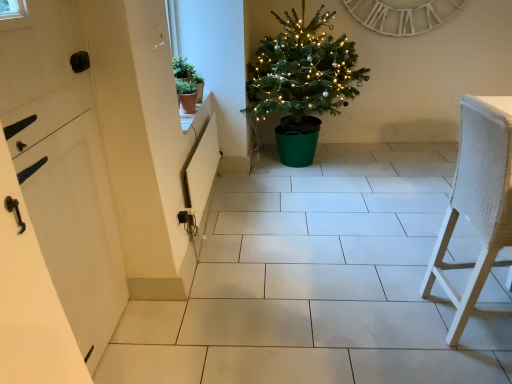
Image resolution: width=512 pixels, height=384 pixels. What do you see at coordinates (188, 116) in the screenshot?
I see `matte brown table at upper center` at bounding box center [188, 116].

Describe the element at coordinates (187, 94) in the screenshot. This screenshot has width=512, height=384. I see `green matte pot at upper left, arranged as the first houseplant when ordered from the bottom` at that location.

Where is `green matte pot at upper left, placed as the second houseplant when sorted from top to bottom`? This screenshot has height=384, width=512. green matte pot at upper left, placed as the second houseplant when sorted from top to bottom is located at coordinates (187, 94).

The image size is (512, 384). Describe the element at coordinates (63, 167) in the screenshot. I see `white painted wood door at left` at that location.

Measure the distance between green plastic christmas tree at center and camera.

green plastic christmas tree at center and camera are 3.07 meters apart.

What do you see at coordinates (477, 201) in the screenshot? This screenshot has height=384, width=512. I see `white woven chair at right` at bounding box center [477, 201].

Measure the distance between point (418, 32) and camera.

The depth of point (418, 32) is 3.66 meters.

This screenshot has height=384, width=512. I want to click on green matte plant pot at upper left, which is the second houseplant in bottom-to-top order, so click(187, 78).

From the image's perspective, between white woven chair at right and white painted wood door at left, who is located below?

white woven chair at right, from the image's perspective.

At what (x,y) coordinates should I click in order to perform the action: click on door on the left of white woven chair at right. Please return your answer as a coordinate pair (x, y). This screenshot has height=384, width=512. Looking at the image, I should click on (63, 167).

Is white woven chair at right shorter than white painted wood door at left?

Yes.

Considering the relative sizes of white woven chair at right and white painted wood door at left in the image provided, is white woven chair at right smaller than white painted wood door at left?

Actually, white woven chair at right might be larger than white painted wood door at left.

Image resolution: width=512 pixels, height=384 pixels. Identify the location of table behind the white woven chair at right. (188, 116).

Is matte brown table at upper center bigger or smaller than white woven chair at right?

matte brown table at upper center is smaller than white woven chair at right.

How different are the orientations of matte brown table at upper center and white woven chair at right in degrees?

2.41 degrees.

Which object is positioned more to the left, matte brown table at upper center or white woven chair at right?

Positioned to the left is matte brown table at upper center.

Locate an element on the screen. The height and width of the screenshot is (384, 512). the 1st houseplant above the white painted wood door at left (from the image's perspective) is located at coordinates (187, 94).

In terms of width, does green matte pot at upper left, arranged as the first houseplant when ordered from the bottom, look wider or thinner when compared to white painted wood door at left?

Clearly, green matte pot at upper left, arranged as the first houseplant when ordered from the bottom, has more width compared to white painted wood door at left.

Which of these two, green matte pot at upper left, placed as the second houseplant when sorted from top to bottom, or white painted wood door at left, stands taller?

With more height is white painted wood door at left.

Is green matte pot at upper left, arranged as the first houseplant when ordered from the bottom, closer to camera compared to white painted wood door at left?

That is False.

Considering the relative sizes of white wooden clock at upper center and matte brown table at upper center in the image provided, is white wooden clock at upper center shorter than matte brown table at upper center?

No.

From a real-world perspective, between white wooden clock at upper center and matte brown table at upper center, who is vertically lower?

→ In real-world perspective, matte brown table at upper center is lower.

From the image's perspective, would you say white wooden clock at upper center is shown under matte brown table at upper center?

Actually, white wooden clock at upper center appears above matte brown table at upper center in the image.

How far apart are green matte pot at upper left, placed as the second houseplant when sorted from top to bottom, and white woven chair at right?

A distance of 1.76 meters exists between green matte pot at upper left, placed as the second houseplant when sorted from top to bottom, and white woven chair at right.

Is green matte pot at upper left, arranged as the first houseplant when ordered from the bottom, at the right side of white woven chair at right?

Incorrect, green matte pot at upper left, arranged as the first houseplant when ordered from the bottom, is not on the right side of white woven chair at right.

Does point (189, 112) come farther from viewer compared to point (478, 100)?

Yes, it is.

From a real-world perspective, is green matte pot at upper left, placed as the second houseplant when sorted from top to bottom, located higher than white woven chair at right?

Yes, from a real-world perspective, green matte pot at upper left, placed as the second houseplant when sorted from top to bottom, is over white woven chair at right

From the image's perspective, is green plastic christmas tree at center above or below green matte pot at upper left, placed as the second houseplant when sorted from top to bottom?

From the image's perspective, green plastic christmas tree at center appears above green matte pot at upper left, placed as the second houseplant when sorted from top to bottom.

In terms of size, does green plastic christmas tree at center appear bigger or smaller than green matte pot at upper left, arranged as the first houseplant when ordered from the bottom?

Clearly, green plastic christmas tree at center is larger in size than green matte pot at upper left, arranged as the first houseplant when ordered from the bottom.

Is green plastic christmas tree at center positioned far away from green matte pot at upper left, arranged as the first houseplant when ordered from the bottom?

That's not correct — green plastic christmas tree at center is a little close to green matte pot at upper left, arranged as the first houseplant when ordered from the bottom.

Are white painted wood door at left and green plastic christmas tree at center located far from each other?

Yes, white painted wood door at left is far from green plastic christmas tree at center.

Is white painted wood door at left spatially inside green plastic christmas tree at center, or outside of it?

white painted wood door at left is spatially situated outside green plastic christmas tree at center.

Is white painted wood door at left in front of or behind green plastic christmas tree at center in the image?

Visually, white painted wood door at left is located in front of green plastic christmas tree at center.

Can you confirm if white painted wood door at left is shorter than green plastic christmas tree at center?

No.

Locate an element on the screen. furniture lying below the white painted wood door at left (from the image's perspective) is located at coordinates (477, 201).

The image size is (512, 384). I want to click on table above the white woven chair at right (from a real-world perspective), so click(188, 116).

Based on their spatial positions, is matte brown table at upper center or white painted wood door at left closer to green plastic christmas tree at center?

matte brown table at upper center.

Based on their spatial positions, is white woven chair at right or white painted wood door at left further from green plastic christmas tree at center?

white painted wood door at left is positioned further to the anchor green plastic christmas tree at center.

When comparing their distances from green plastic christmas tree at center, does green matte plant pot at upper left, which is the second houseplant in bottom-to-top order, or white woven chair at right seem further?

white woven chair at right lies further to green plastic christmas tree at center than the other object.

Which object lies further to the anchor point green plastic christmas tree at center, white painted wood door at left or white woven chair at right?

Based on the image, white painted wood door at left appears to be further to green plastic christmas tree at center.

Based on their spatial positions, is matte brown table at upper center or green plastic christmas tree at center further from green matte plant pot at upper left, the 1th houseplant from the top?

green plastic christmas tree at center is further to green matte plant pot at upper left, the 1th houseplant from the top.

Looking at the image, which one is located further to matte brown table at upper center, green plastic christmas tree at center or white painted wood door at left?

white painted wood door at left is positioned further to the anchor matte brown table at upper center.

Which object lies nearer to the anchor point white wooden clock at upper center, white painted wood door at left or matte brown table at upper center?

matte brown table at upper center is closer to white wooden clock at upper center.

Which object lies nearer to the anchor point green matte plant pot at upper left, the 1th houseplant from the top, white wooden clock at upper center or white woven chair at right?

white wooden clock at upper center is positioned closer to the anchor green matte plant pot at upper left, the 1th houseplant from the top.

At what (x,y) coordinates should I click in order to perform the action: click on houseplant located between matte brown table at upper center and white woven chair at right in the left-right direction. Please return your answer as a coordinate pair (x, y). Image resolution: width=512 pixels, height=384 pixels. Looking at the image, I should click on (187, 94).

You are a GUI agent. You are given a task and a screenshot of the screen. Output one action in this format:
    pyautogui.click(x=<x>, y=<y>)
    Task: Click on the table between white painted wood door at left and white woven chair at right from left to right
    
    Given the screenshot: What is the action you would take?
    pyautogui.click(x=188, y=116)

The height and width of the screenshot is (384, 512). Identify the location of houseplant between green matte plant pot at upper left, the 1th houseplant from the top, and green plastic christmas tree at center. (187, 94).

The height and width of the screenshot is (384, 512). In order to click on table between white painted wood door at left and white wooden clock at upper center along the z-axis in this screenshot , I will do `click(188, 116)`.